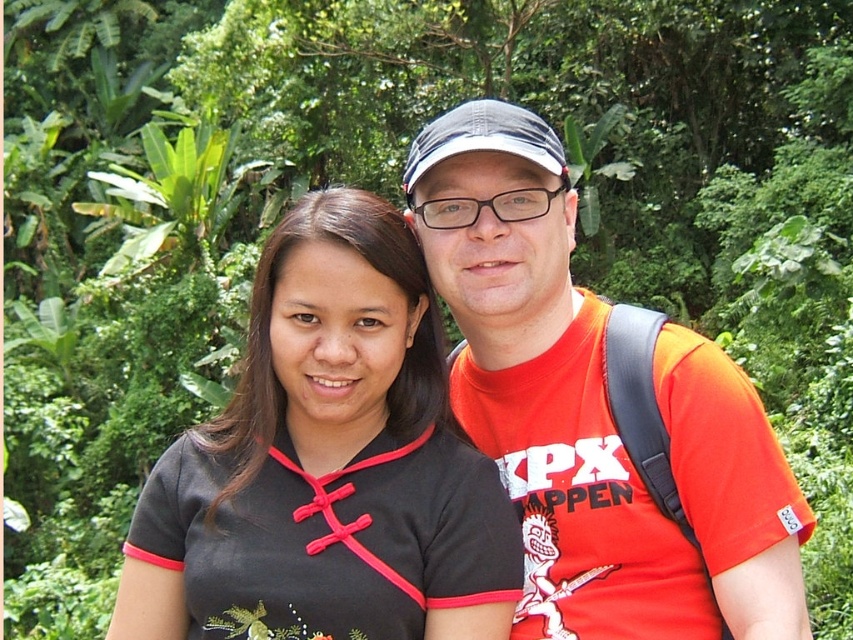
Question: Can you confirm if black matte shirt at center is positioned to the right of orange cotton t-shirt at center?

Choices:
 (A) no
 (B) yes

Answer: (A)

Question: Does black matte shirt at center appear over orange cotton t-shirt at center?

Choices:
 (A) yes
 (B) no

Answer: (B)

Question: Where is black matte shirt at center located in relation to orange cotton t-shirt at center in the image?

Choices:
 (A) right
 (B) left

Answer: (B)

Question: Which point is farther from the camera taking this photo?

Choices:
 (A) (497, 509)
 (B) (428, 150)

Answer: (B)

Question: Which object is farther from the camera taking this photo?

Choices:
 (A) black matte shirt at center
 (B) orange cotton t-shirt at center

Answer: (A)